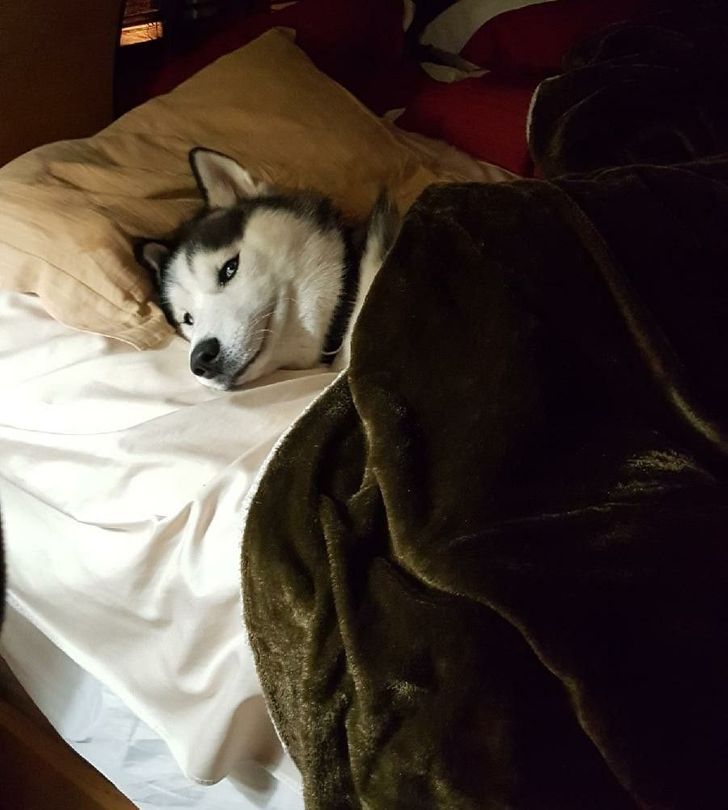
This screenshot has width=728, height=810. What are the coordinates of `sheet` in the screenshot? It's located at (170, 516).